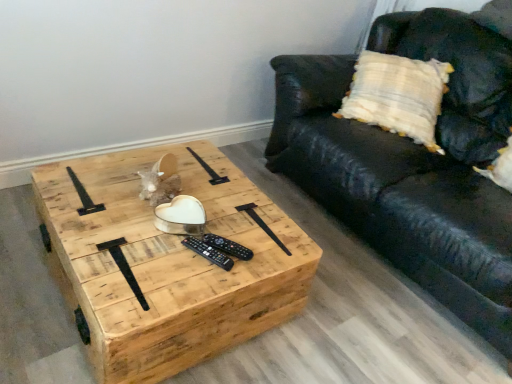
Question: Is black plastic remote at center, the 2th remote when ordered from front to back, smaller than black plastic remote at center, the 2th remote in the back-to-front sequence?

Choices:
 (A) no
 (B) yes

Answer: (A)

Question: Is black plastic remote at center, the 2th remote when ordered from front to back, behind black plastic remote at center, the 1th remote viewed from the front?

Choices:
 (A) yes
 (B) no

Answer: (A)

Question: Does black plastic remote at center, which is the 1th remote from back to front, lie in front of black plastic remote at center, the 2th remote in the back-to-front sequence?

Choices:
 (A) no
 (B) yes

Answer: (A)

Question: Does black plastic remote at center, the 2th remote when ordered from front to back, have a lesser width compared to black plastic remote at center, the 1th remote viewed from the front?

Choices:
 (A) no
 (B) yes

Answer: (A)

Question: Is black plastic remote at center, which is the 1th remote from back to front, bigger than black plastic remote at center, the 2th remote in the back-to-front sequence?

Choices:
 (A) no
 (B) yes

Answer: (B)

Question: Is black plastic remote at center, the 2th remote when ordered from front to back, in contact with black plastic remote at center, the 2th remote in the back-to-front sequence?

Choices:
 (A) no
 (B) yes

Answer: (B)

Question: Is there a large distance between natural wood coffee table at center and black leather couch at center?

Choices:
 (A) yes
 (B) no

Answer: (B)

Question: Considering the relative positions of natural wood coffee table at center and black leather couch at center in the image provided, is natural wood coffee table at center to the left of black leather couch at center from the viewer's perspective?

Choices:
 (A) no
 (B) yes

Answer: (B)

Question: From a real-world perspective, is natural wood coffee table at center over black leather couch at center?

Choices:
 (A) no
 (B) yes

Answer: (A)

Question: Does natural wood coffee table at center touch black leather couch at center?

Choices:
 (A) yes
 (B) no

Answer: (B)

Question: Considering the relative sizes of natural wood coffee table at center and black leather couch at center in the image provided, is natural wood coffee table at center taller than black leather couch at center?

Choices:
 (A) no
 (B) yes

Answer: (A)

Question: Is natural wood coffee table at center looking in the opposite direction of black leather couch at center?

Choices:
 (A) yes
 (B) no

Answer: (B)

Question: From the image's perspective, is black leather couch at center on top of natural wood coffee table at center?

Choices:
 (A) yes
 (B) no

Answer: (A)